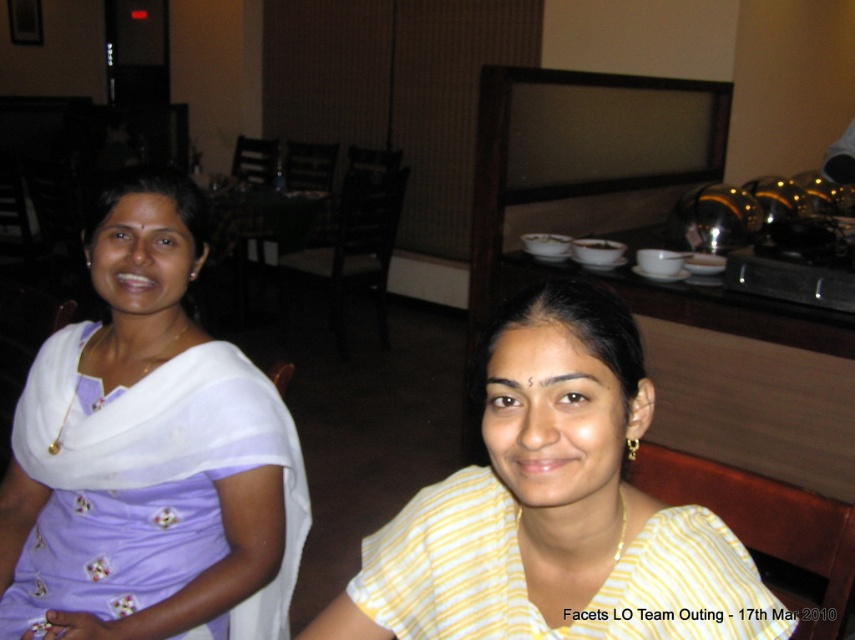
Question: Is purple silk saree at left thinner than yellow striped blouse at center?

Choices:
 (A) yes
 (B) no

Answer: (B)

Question: Is purple silk saree at left smaller than yellow striped fabric at center?

Choices:
 (A) yes
 (B) no

Answer: (B)

Question: Among these objects, which one is farthest from the camera?

Choices:
 (A) yellow striped blouse at center
 (B) purple silk saree at left

Answer: (B)

Question: Based on their relative distances, which object is nearer to the yellow striped fabric at center?

Choices:
 (A) purple silk saree at left
 (B) yellow striped blouse at center

Answer: (B)

Question: Which of the following is the farthest from the observer?

Choices:
 (A) (476, 608)
 (B) (432, 534)
 (C) (50, 429)

Answer: (C)

Question: Is yellow striped blouse at center smaller than yellow striped fabric at center?

Choices:
 (A) no
 (B) yes

Answer: (A)